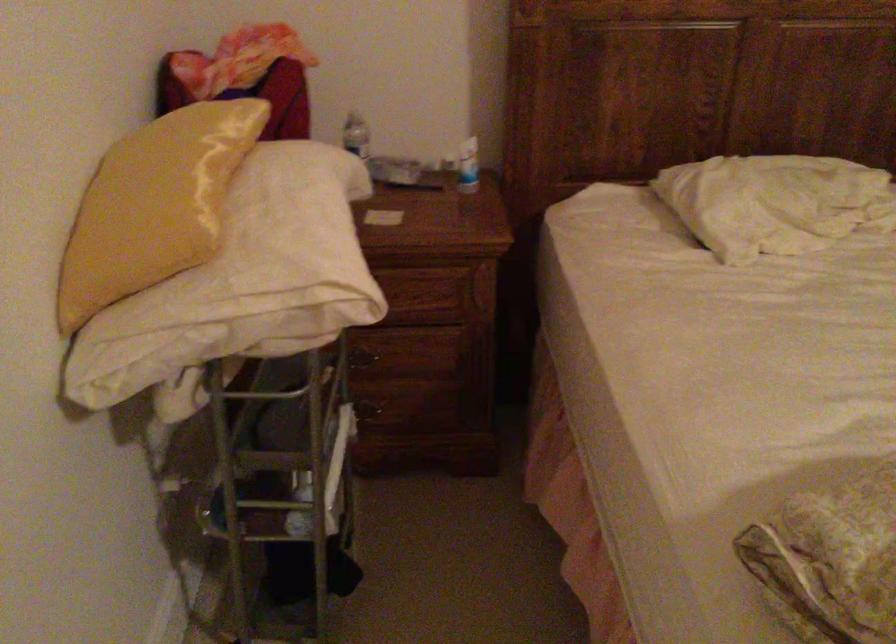
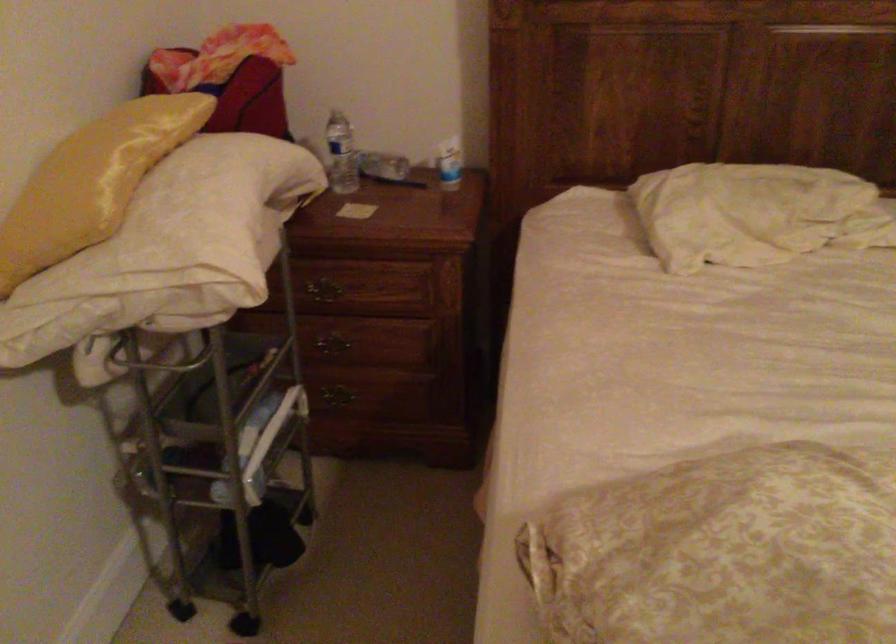
Question: Based on the continuous images, in which direction is the camera rotating? Reply with the corresponding letter.

Choices:
 (A) Left
 (B) Right
 (C) Up
 (D) Down

Answer: (A)